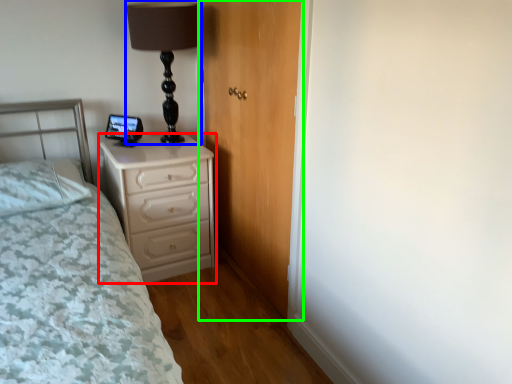
Question: Considering the real-world distances, which object is farthest from chest of drawers (highlighted by a red box)? table lamp (highlighted by a blue box) or door (highlighted by a green box)?

Choices:
 (A) table lamp
 (B) door

Answer: (A)